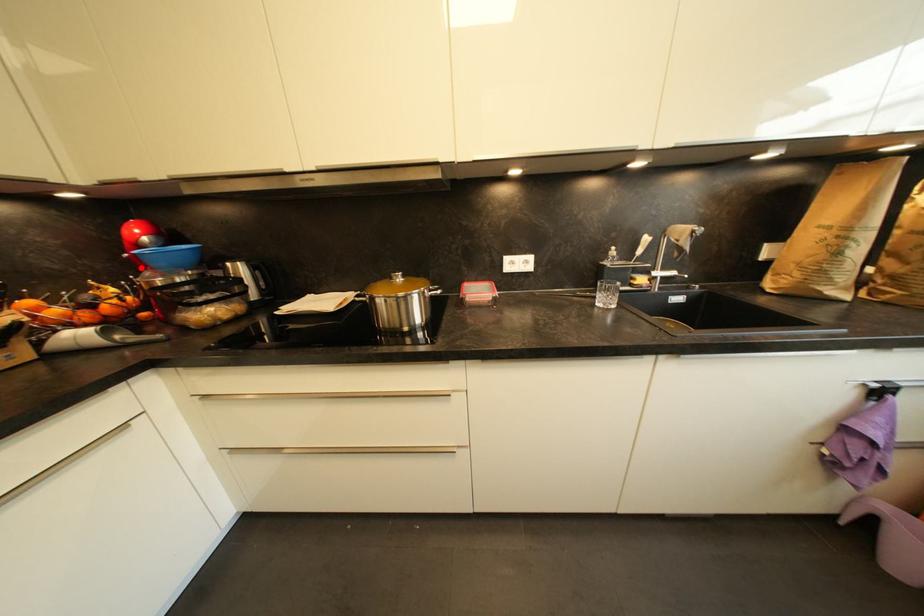
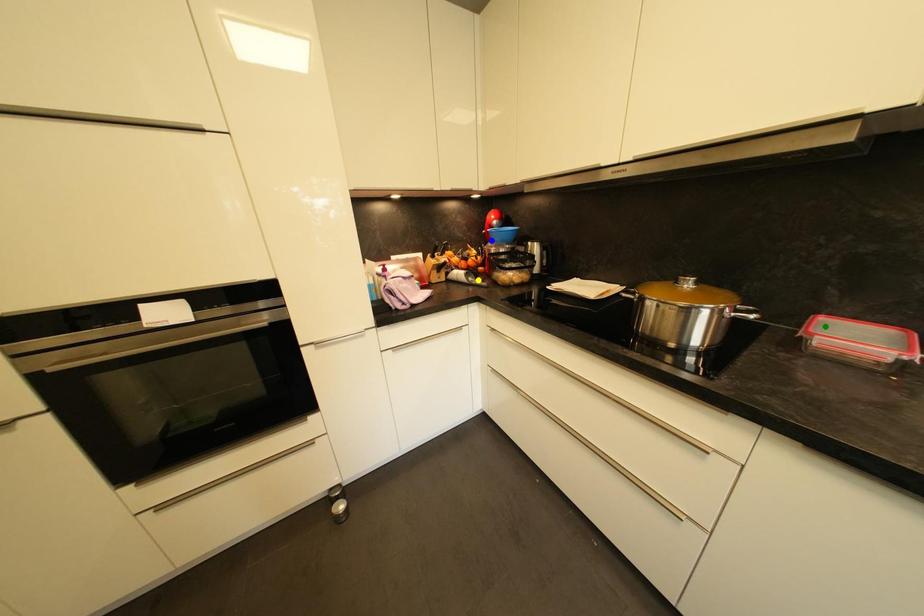
Question: I am providing you with two images of the same scene from different viewpoints. A red point is marked on the first image. You are given multiple points on the second image. Which point in image 2 is actually the same real-world point as the red point in image 1?

Choices:
 (A) green point
 (B) yellow point
 (C) blue point

Answer: (C)